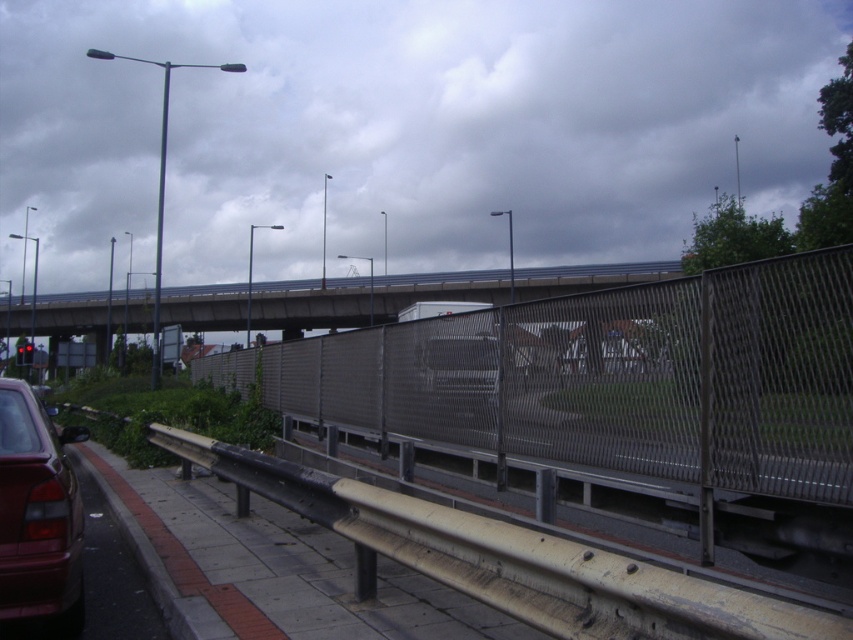
Is concrete bridge at upper center smaller than shiny red car at lower left?

No, concrete bridge at upper center is not smaller than shiny red car at lower left.

Can you confirm if concrete bridge at upper center is shorter than shiny red car at lower left?

No.

Which is behind, point (631, 268) or point (0, 406)?

Positioned behind is point (631, 268).

Where is `concrete bridge at upper center`? concrete bridge at upper center is located at coordinates (309, 305).

Is metal mesh fence at center to the right of shiny red car at lower left from the viewer's perspective?

In fact, metal mesh fence at center is to the left of shiny red car at lower left.

Find the location of a particular element. The height and width of the screenshot is (640, 853). metal mesh fence at center is located at coordinates (624, 396).

Is metal mesh fence at center positioned at the back of concrete bridge at upper center?

No, metal mesh fence at center is in front of concrete bridge at upper center.

Can you confirm if metal mesh fence at center is positioned above concrete bridge at upper center?

Incorrect, metal mesh fence at center is not positioned above concrete bridge at upper center.

What do you see at coordinates (624, 396) in the screenshot? This screenshot has width=853, height=640. I see `metal mesh fence at center` at bounding box center [624, 396].

The width and height of the screenshot is (853, 640). I want to click on metal mesh fence at center, so click(x=624, y=396).